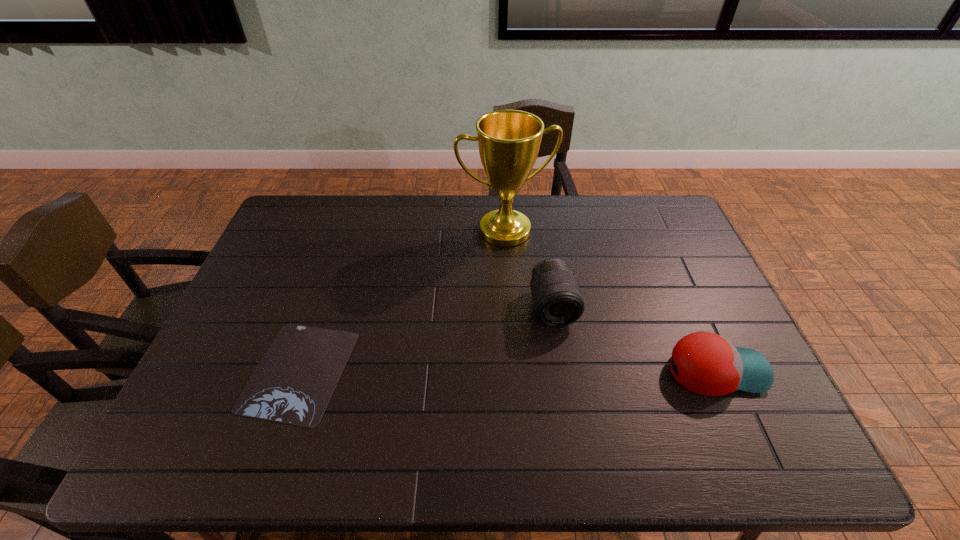
This screenshot has height=540, width=960. In order to click on vacant region between the tallest object and the baseball cap in this screenshot , I will do `click(611, 301)`.

Identify the location of vacant area between the shortest object and the baseball cap. Image resolution: width=960 pixels, height=540 pixels. (508, 371).

At what (x,y) coordinates should I click in order to perform the action: click on vacant point located between the shortest object and the rightmost object. Please return your answer as a coordinate pair (x, y). This screenshot has width=960, height=540. Looking at the image, I should click on (508, 371).

Find the location of `empty location between the rightmost object and the shortest object`. empty location between the rightmost object and the shortest object is located at coordinates click(x=508, y=371).

You are a GUI agent. You are given a task and a screenshot of the screen. Output one action in this format:
    pyautogui.click(x=<x>, y=<y>)
    Task: Click on the vacant region between the tallest object and the telephoto lens
    The image size is (960, 540).
    Given the screenshot: What is the action you would take?
    pyautogui.click(x=529, y=269)

Find the location of a particular element. The width and height of the screenshot is (960, 540). free space that is in between the telephoto lens and the rightmost object is located at coordinates (635, 339).

At what (x,y) coordinates should I click in order to perform the action: click on free spot between the rightmost object and the third shortest object. Please return your answer as a coordinate pair (x, y). This screenshot has height=540, width=960. Looking at the image, I should click on (635, 339).

Where is `the third closest object to the shortest object`? This screenshot has width=960, height=540. the third closest object to the shortest object is located at coordinates (708, 364).

This screenshot has height=540, width=960. I want to click on object that stands as the closest to the mousepad, so click(508, 140).

Find the location of a particular element. Image resolution: width=960 pixels, height=540 pixels. vacant position in the image that satisfies the following two spatial constraints: 1. on the back side of the leftmost object; 2. on the right side of the award is located at coordinates (347, 231).